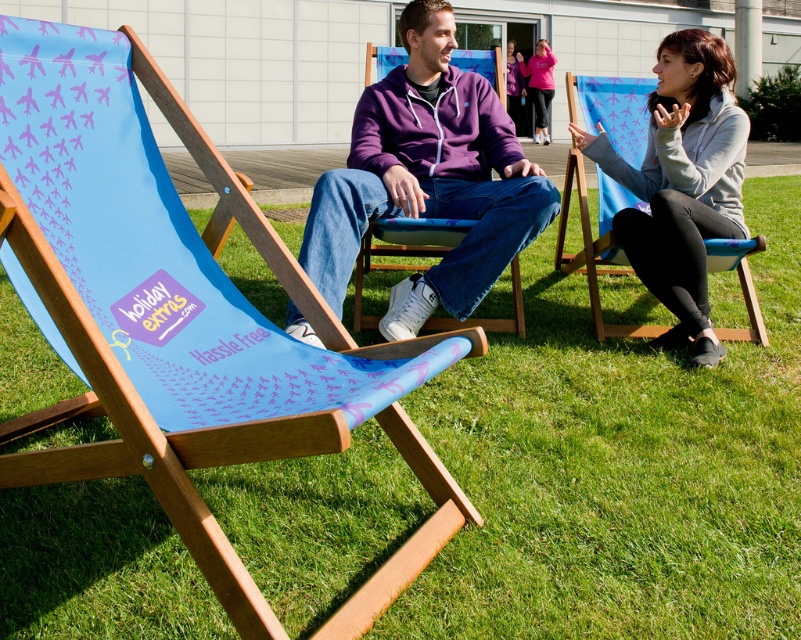
Between point (175, 410) and point (702, 307), which one is positioned in front?

Point (175, 410)

Find the location of a particular element. blue wood beach chair at center is located at coordinates (180, 314).

You are a GUI agent. You are given a task and a screenshot of the screen. Output one action in this format:
    pyautogui.click(x=<x>, y=<y>)
    Task: Click on the blue wood beach chair at center
    This screenshot has height=640, width=801.
    Given the screenshot: What is the action you would take?
    pyautogui.click(x=180, y=314)

Between purple fleece jacket at center and gray fleece jacket at right, which one is positioned lower?

purple fleece jacket at center is lower down.

The image size is (801, 640). What do you see at coordinates (427, 179) in the screenshot?
I see `purple fleece jacket at center` at bounding box center [427, 179].

Locate an element on the screen. purple fleece jacket at center is located at coordinates (427, 179).

Looking at this image, can you confirm if purple fleece jacket at center is smaller than matte pink hoodie at center?

Correct, purple fleece jacket at center occupies less space than matte pink hoodie at center.

What are the coordinates of `purple fleece jacket at center` in the screenshot? It's located at (427, 179).